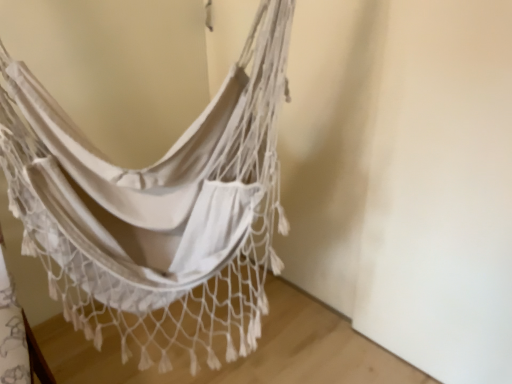
The image size is (512, 384). What do you see at coordinates (157, 209) in the screenshot?
I see `white fabric hammock at center` at bounding box center [157, 209].

Where is `white fabric hammock at center`? white fabric hammock at center is located at coordinates (157, 209).

This screenshot has width=512, height=384. In order to click on white fabric hammock at center in this screenshot , I will do `click(157, 209)`.